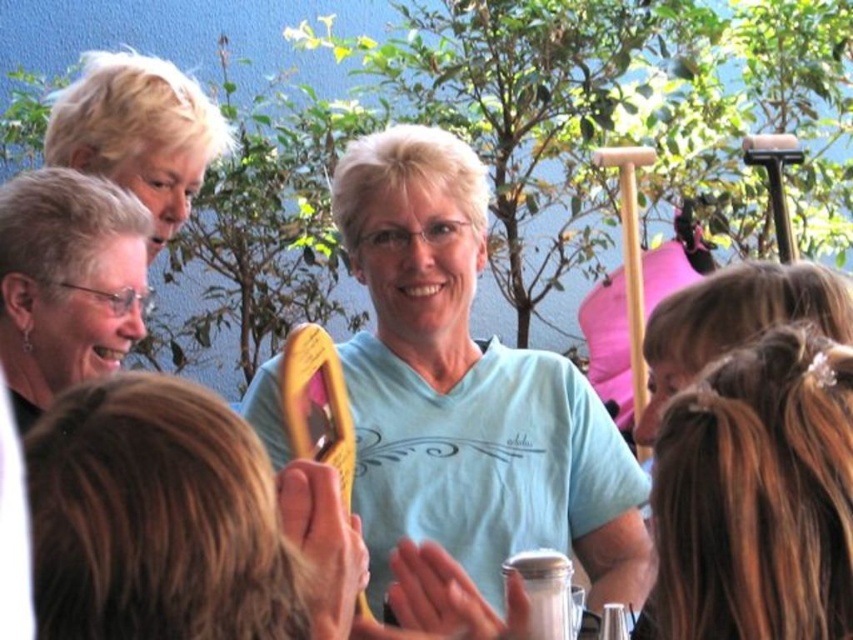
Question: Can you confirm if wooden spoon at center is positioned above matte black hair at left?

Choices:
 (A) yes
 (B) no

Answer: (B)

Question: Which point is farther to the camera?

Choices:
 (A) light blue cotton shirt at center
 (B) wooden spoon at center
 (C) matte black hair at left

Answer: (A)

Question: Does brown hair at center appear over matte black hair at left?

Choices:
 (A) yes
 (B) no

Answer: (B)

Question: Which object appears farthest from the camera in this image?

Choices:
 (A) brown hair at center
 (B) wooden spoon at center

Answer: (A)

Question: Based on their relative distances, which object is farther from the wooden spoon at center?

Choices:
 (A) brown hair at center
 (B) light blue cotton shirt at center
 (C) matte black hair at left

Answer: (B)

Question: From the image, what is the correct spatial relationship of wooden spoon at center in relation to brown hair at center?

Choices:
 (A) above
 (B) below

Answer: (B)